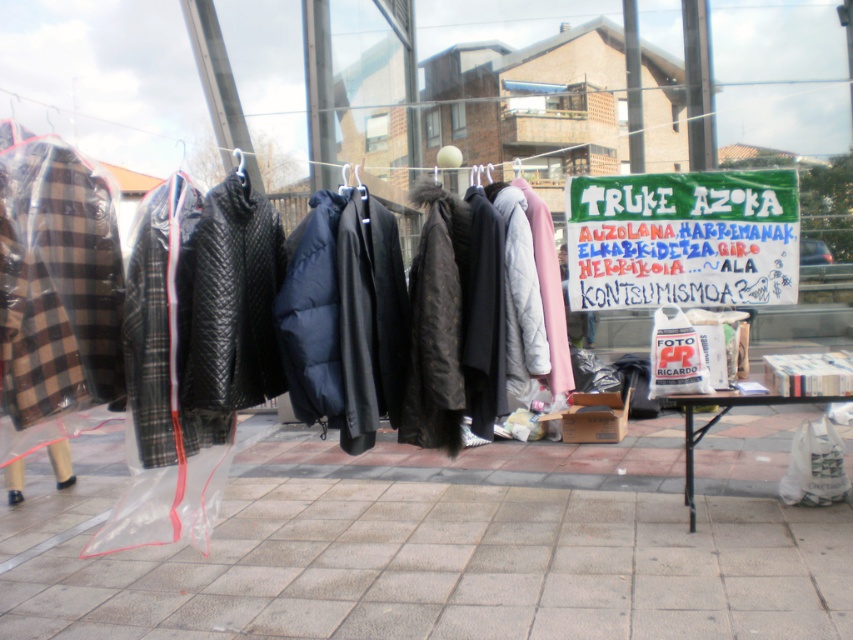
Between gray concrete pavement at lower center and green fabric sign at upper center, which one has less height?

Standing shorter between the two is gray concrete pavement at lower center.

Between gray concrete pavement at lower center and green fabric sign at upper center, which one has more height?

green fabric sign at upper center is taller.

Where is `gray concrete pavement at lower center`? This screenshot has height=640, width=853. gray concrete pavement at lower center is located at coordinates (456, 566).

Does green fabric sign at upper center come in front of white plastic table at lower right?

Yes, green fabric sign at upper center is closer to the viewer.

This screenshot has width=853, height=640. I want to click on green fabric sign at upper center, so click(x=682, y=237).

Find the location of a particular element. green fabric sign at upper center is located at coordinates (682, 237).

Measure the distance from gray concrete pavement at lower center to white plastic table at lower right.

The distance of gray concrete pavement at lower center from white plastic table at lower right is 3.87 feet.

Does gray concrete pavement at lower center have a lesser height compared to white plastic table at lower right?

Correct, gray concrete pavement at lower center is not as tall as white plastic table at lower right.

Is point (97, 602) closer to viewer compared to point (763, 400)?

Yes, point (97, 602) is in front of point (763, 400).

Where is `gray concrete pavement at lower center`? This screenshot has width=853, height=640. gray concrete pavement at lower center is located at coordinates (456, 566).